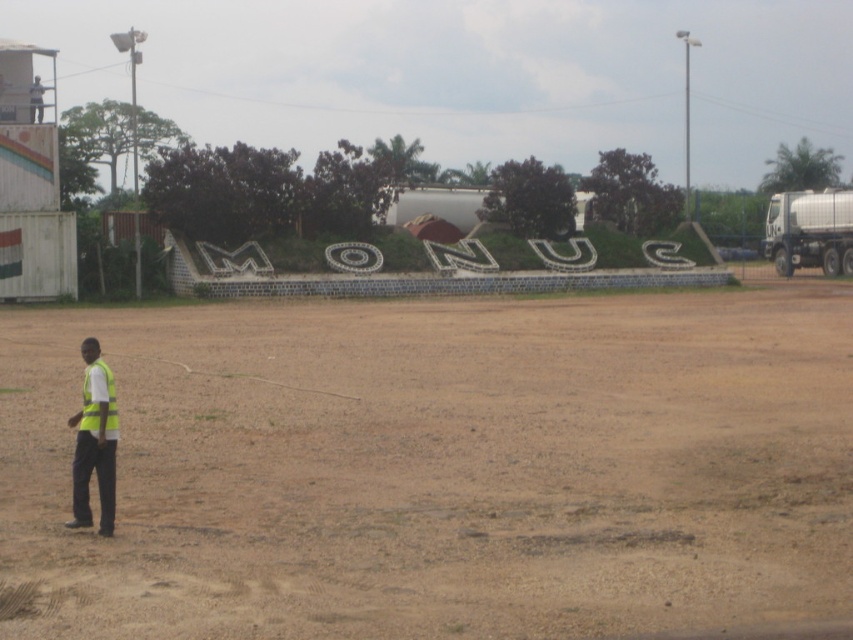
Question: Estimate the real-world distances between objects in this image. Which object is farther from the yellow reflective safety vest at lower left?

Choices:
 (A) brown sandy dirt field at center
 (B) yellow reflective vest at lower left

Answer: (A)

Question: Can you confirm if brown sandy dirt field at center is positioned above yellow reflective vest at lower left?

Choices:
 (A) yes
 (B) no

Answer: (B)

Question: Can you confirm if brown sandy dirt field at center is positioned above yellow reflective vest at lower left?

Choices:
 (A) yes
 (B) no

Answer: (B)

Question: Estimate the real-world distances between objects in this image. Which object is closer to the brown sandy dirt field at center?

Choices:
 (A) yellow reflective vest at lower left
 (B) yellow reflective safety vest at lower left

Answer: (A)

Question: Which object is closer to the camera taking this photo?

Choices:
 (A) brown sandy dirt field at center
 (B) yellow reflective vest at lower left

Answer: (A)

Question: Does brown sandy dirt field at center appear on the right side of yellow reflective vest at lower left?

Choices:
 (A) yes
 (B) no

Answer: (A)